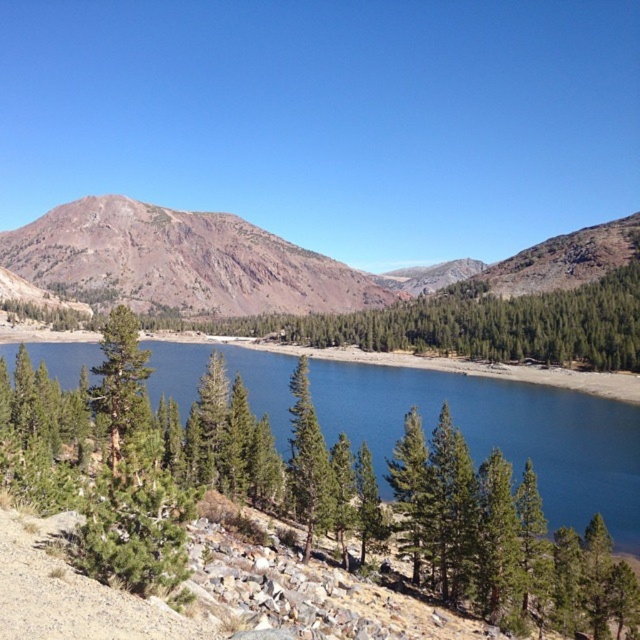
You are standing at the base of the rocky slope in the foreground of the mountainous landscape. You see two points marked on the image, point 1 at coordinates point (x=180, y=403) and point 2 at coordinates point (x=234, y=225). Which point is closer to you?

Point (x=180, y=403) is in front of point (x=234, y=225), so it is closer to you.

You are planning to take a photo of the brown rocky mountain at upper left and the green matte tree at left from a position where both are visible. Which object will occupy more horizontal space in your photo?

The brown rocky mountain at upper left will occupy more horizontal space in the photo because its width is larger than that of the green matte tree at left.

You are planning to take a photo of the blue glassy water at center and the green textured tree at center in the mountainous landscape. Which object will appear wider in the photo?

The green textured tree at center will appear wider in the photo because its width is greater than the blue glassy water at center.